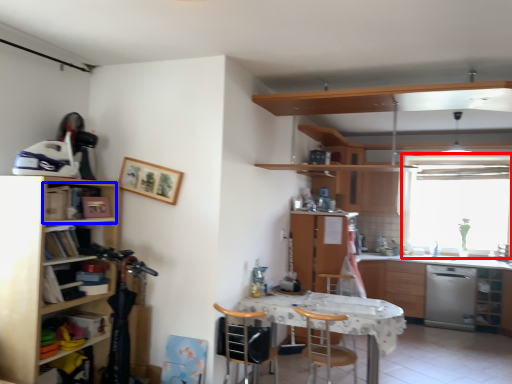
Question: Which object is further to the camera taking this photo, window (highlighted by a red box) or cabinet (highlighted by a blue box)?

Choices:
 (A) window
 (B) cabinet

Answer: (A)